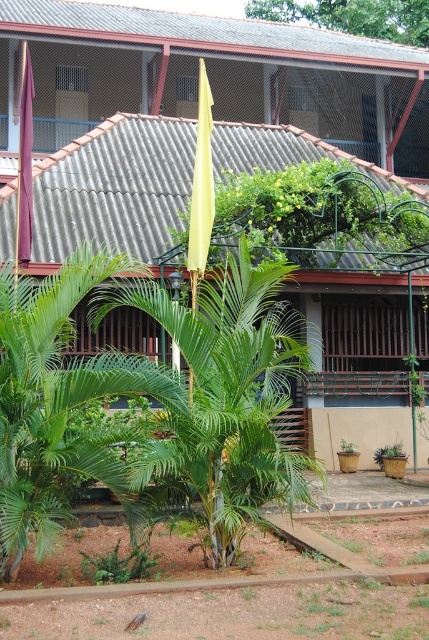
Question: Does green leafy palm at center have a smaller size compared to green matte planter at lower center?

Choices:
 (A) no
 (B) yes

Answer: (A)

Question: Can you confirm if green leafy palm at center is smaller than green leafy palm tree at center?

Choices:
 (A) yes
 (B) no

Answer: (B)

Question: Which of the following is the farthest from the observer?

Choices:
 (A) (259, 477)
 (B) (375, 458)
 (C) (11, 310)

Answer: (B)

Question: Which point is farther to the camera?

Choices:
 (A) (68, 394)
 (B) (402, 451)

Answer: (B)

Question: Where is green leafy palm tree at center located in relation to green matte planter at lower center in the image?

Choices:
 (A) left
 (B) right

Answer: (A)

Question: Which point is farther to the camera?

Choices:
 (A) (202, 404)
 (B) (163, 368)

Answer: (B)